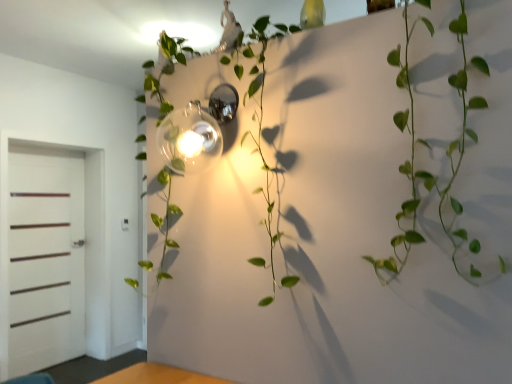
What do you see at coordinates (196, 132) in the screenshot? I see `polished chrome sconce at center` at bounding box center [196, 132].

Image resolution: width=512 pixels, height=384 pixels. What do you see at coordinates (46, 257) in the screenshot?
I see `white matte door at left` at bounding box center [46, 257].

At what (x,y) coordinates should I click in order to perform the action: click on green leafy vine at center. Please return your answer as a coordinate pair (x, y). Looking at the image, I should click on (431, 149).

Considering the relative sizes of polished chrome sconce at center and white matte door at left in the image provided, is polished chrome sconce at center wider than white matte door at left?

Indeed, polished chrome sconce at center has a greater width compared to white matte door at left.

Is polished chrome sconce at center positioned beyond the bounds of white matte door at left?

Yes, polished chrome sconce at center is located beyond the bounds of white matte door at left.

Considering the relative positions of polished chrome sconce at center and white matte door at left in the image provided, is polished chrome sconce at center to the right of white matte door at left from the viewer's perspective?

Indeed, polished chrome sconce at center is positioned on the right side of white matte door at left.

From a real-world perspective, is polished chrome sconce at center positioned above or below white matte door at left?

Clearly, from a real-world perspective, polished chrome sconce at center is above white matte door at left.

Is green leafy vine at center facing towards green leafy vine at center?

No, green leafy vine at center is not facing towards green leafy vine at center.

The width and height of the screenshot is (512, 384). I want to click on houseplant on the right of green leafy vine at center, so click(x=431, y=149).

Between green leafy vine at center and green leafy vine at center, which one has smaller width?

green leafy vine at center.

Which point is more distant from viewer, (164, 152) or (398, 246)?

The point (164, 152) is more distant.

Considering the positions of objects green leafy vine at center and polished chrome sconce at center in the image provided, who is more to the right, green leafy vine at center or polished chrome sconce at center?

polished chrome sconce at center.

In the scene shown: From the image's perspective, which one is positioned lower, green leafy vine at center or polished chrome sconce at center?

green leafy vine at center.

Are green leafy vine at center and polished chrome sconce at center making contact?

Indeed, green leafy vine at center and polished chrome sconce at center are beside each other and touching.

Considering the relative sizes of green leafy vine at center and polished chrome sconce at center in the image provided, is green leafy vine at center taller than polished chrome sconce at center?

Indeed, green leafy vine at center has a greater height compared to polished chrome sconce at center.

Who is bigger, green leafy vine at center or white matte door at left?

Bigger between the two is green leafy vine at center.

Does green leafy vine at center turn towards white matte door at left?

No, green leafy vine at center is not oriented towards white matte door at left.

Can you tell me how much green leafy vine at center and white matte door at left differ in facing direction?

green leafy vine at center and white matte door at left are facing 89.9 degrees away from each other.

Is green leafy vine at center at the left side of white matte door at left?

Incorrect, green leafy vine at center is not on the left side of white matte door at left.

From a real-world perspective, is green leafy vine at center positioned over green leafy vine at center based on gravity?

Incorrect, from a real-world perspective, green leafy vine at center is lower than green leafy vine at center.

Is green leafy vine at center in front of or behind green leafy vine at center in the image?

green leafy vine at center is positioned closer to the viewer than green leafy vine at center.

Does green leafy vine at center turn towards green leafy vine at center?

No, green leafy vine at center is not aimed at green leafy vine at center.

Is green leafy vine at center taller or shorter than green leafy vine at center?

In the image, green leafy vine at center appears to be taller than green leafy vine at center.

Which point is more forward, (81, 352) or (223, 110)?

The point (223, 110) is in front.

Locate an element on the screen. light fixture located in front of the white matte door at left is located at coordinates (196, 132).

Is white matte door at left taller or shorter than polished chrome sconce at center?

In the image, white matte door at left appears to be taller than polished chrome sconce at center.

Between polished chrome sconce at center and green leafy vine at center, which one appears on the right side from the viewer's perspective?

Positioned to the right is polished chrome sconce at center.

Is polished chrome sconce at center oriented away from green leafy vine at center?

Yes.

Is point (176, 135) positioned behind point (164, 277)?

No, it is in front of (164, 277).

Looking at the image, does polished chrome sconce at center seem bigger or smaller compared to green leafy vine at center?

polished chrome sconce at center is smaller than green leafy vine at center.

You are a GUI agent. You are given a task and a screenshot of the screen. Output one action in this format:
    pyautogui.click(x=<x>, y=<y>)
    Task: Click on the light fixture on the right of white matte door at left
    This screenshot has width=512, height=384.
    Given the screenshot: What is the action you would take?
    pyautogui.click(x=196, y=132)

You are a GUI agent. You are given a task and a screenshot of the screen. Output one action in this format:
    pyautogui.click(x=<x>, y=<y>)
    Task: Click on the plant above the green leafy vine at center (from the image's perspective)
    The height and width of the screenshot is (384, 512).
    Given the screenshot: What is the action you would take?
    pyautogui.click(x=260, y=119)

Which object lies further to the anchor point white matte door at left, green leafy vine at center or green leafy vine at center?

Among the two, green leafy vine at center is located further to white matte door at left.

When comparing their distances from green leafy vine at center, does green leafy vine at center or polished chrome sconce at center seem closer?

polished chrome sconce at center is positioned closer to the anchor green leafy vine at center.

Considering their positions, is green leafy vine at center positioned closer to green leafy vine at center than white matte door at left?

green leafy vine at center is closer to green leafy vine at center.

Consider the image. Looking at the image, which one is located closer to white matte door at left, green leafy vine at center or green leafy vine at center?

Among the two, green leafy vine at center is located nearer to white matte door at left.

Based on their spatial positions, is polished chrome sconce at center or green leafy vine at center closer to white matte door at left?

Among the two, polished chrome sconce at center is located nearer to white matte door at left.

Estimate the real-world distances between objects in this image. Which object is further from green leafy vine at center, polished chrome sconce at center or green leafy vine at center?

polished chrome sconce at center.

Based on their spatial positions, is green leafy vine at center or green leafy vine at center closer to polished chrome sconce at center?

green leafy vine at center is positioned closer to the anchor polished chrome sconce at center.

Which object lies further to the anchor point polished chrome sconce at center, green leafy vine at center or white matte door at left?

Based on the image, white matte door at left appears to be further to polished chrome sconce at center.

Find the location of a particular element. light fixture situated between green leafy vine at center and green leafy vine at center from left to right is located at coordinates (196, 132).

You are a GUI agent. You are given a task and a screenshot of the screen. Output one action in this format:
    pyautogui.click(x=<x>, y=<y>)
    Task: Click on the light fixture between green leafy vine at center and white matte door at left from front to back
    
    Given the screenshot: What is the action you would take?
    196,132

Where is `plant between green leafy vine at center and white matte door at left along the z-axis`? Image resolution: width=512 pixels, height=384 pixels. plant between green leafy vine at center and white matte door at left along the z-axis is located at coordinates (260, 119).

I want to click on light fixture between green leafy vine at center and white matte door at left along the z-axis, so click(x=196, y=132).